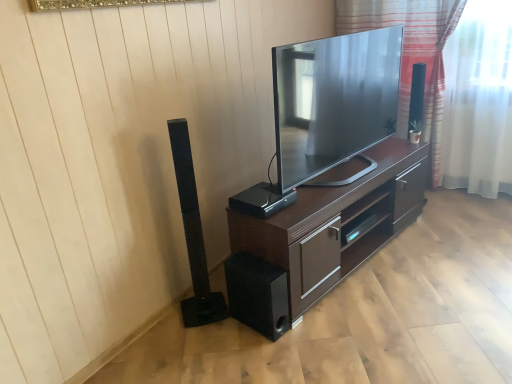
Question: Is black matte speaker at lower center, the 2th speaker positioned from the right, in front of striped fabric at upper right?

Choices:
 (A) no
 (B) yes

Answer: (B)

Question: Does black matte speaker at lower center, the 2th speaker positioned from the right, turn towards striped fabric at upper right?

Choices:
 (A) yes
 (B) no

Answer: (B)

Question: Is black matte speaker at lower center, the second speaker when ordered from left to right, further to the viewer compared to striped fabric at upper right?

Choices:
 (A) yes
 (B) no

Answer: (B)

Question: Is black matte speaker at lower center, the 2th speaker positioned from the right, turned away from striped fabric at upper right?

Choices:
 (A) yes
 (B) no

Answer: (B)

Question: Is black matte speaker at lower center, the second speaker when ordered from left to right, located outside striped fabric at upper right?

Choices:
 (A) no
 (B) yes

Answer: (B)

Question: Is matte black tv at center inside or outside of striped fabric at upper right?

Choices:
 (A) inside
 (B) outside

Answer: (B)

Question: Would you say matte black tv at center is to the left or to the right of striped fabric at upper right in the picture?

Choices:
 (A) right
 (B) left

Answer: (B)

Question: Considering the positions of matte black tv at center and striped fabric at upper right in the image, is matte black tv at center taller or shorter than striped fabric at upper right?

Choices:
 (A) tall
 (B) short

Answer: (B)

Question: Relative to striped fabric at upper right, is matte black tv at center in front or behind?

Choices:
 (A) behind
 (B) front

Answer: (B)

Question: From the image's perspective, is black matte speaker at left, the first speaker viewed from the left, located above or below black plastic speaker at center, the 1th speaker in the right-to-left sequence?

Choices:
 (A) below
 (B) above

Answer: (A)

Question: In the image, is black matte speaker at left, the first speaker viewed from the left, positioned in front of or behind black plastic speaker at center, the 1th speaker in the right-to-left sequence?

Choices:
 (A) behind
 (B) front

Answer: (B)

Question: Considering the positions of point (189, 236) and point (247, 198), is point (189, 236) closer or farther from the camera than point (247, 198)?

Choices:
 (A) closer
 (B) farther

Answer: (A)

Question: Is black matte speaker at left, the first speaker viewed from the left, wider or thinner than black plastic speaker at center, the 1th speaker in the right-to-left sequence?

Choices:
 (A) thin
 (B) wide

Answer: (A)

Question: Is matte black tv at center wider or thinner than dark wood cabinet at center?

Choices:
 (A) wide
 (B) thin

Answer: (B)

Question: Considering the relative positions of matte black tv at center and dark wood cabinet at center in the image provided, is matte black tv at center to the left or to the right of dark wood cabinet at center?

Choices:
 (A) left
 (B) right

Answer: (A)